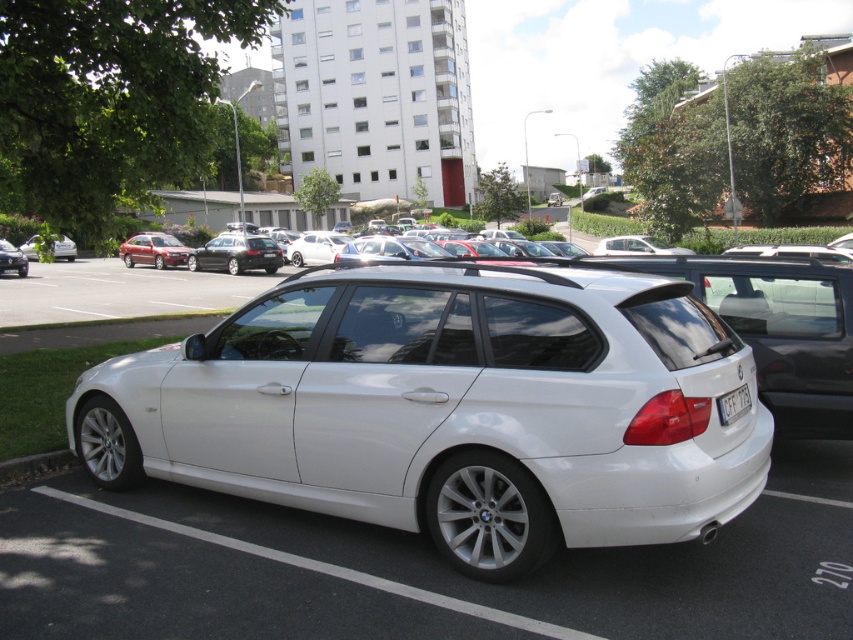
Who is more forward, [260,253] or [718,404]?

Positioned in front is point [718,404].

Between shiny black sedan at center and black plastic license plate at rear, which one is positioned higher?

Positioned higher is shiny black sedan at center.

Is point (206, 246) closer to camera compared to point (726, 417)?

No, it is behind (726, 417).

Where is `shiny black sedan at center`? The height and width of the screenshot is (640, 853). shiny black sedan at center is located at coordinates (236, 253).

Who is shorter, matte silver hatchback at left or matte black sedan at left?

matte black sedan at left

Based on the photo, is matte silver hatchback at left to the right of matte black sedan at left from the viewer's perspective?

Indeed, matte silver hatchback at left is positioned on the right side of matte black sedan at left.

Describe the element at coordinates (62, 248) in the screenshot. I see `matte silver hatchback at left` at that location.

This screenshot has width=853, height=640. What are the coordinates of `matte silver hatchback at left` in the screenshot? It's located at (62, 248).

Does metallic red sedan at center have a greater width compared to matte silver hatchback at left?

No, metallic red sedan at center is not wider than matte silver hatchback at left.

Who is higher up, metallic red sedan at center or matte silver hatchback at left?

Positioned higher is metallic red sedan at center.

Which is in front, point (169, 252) or point (33, 241)?

Point (169, 252) is more forward.

At what (x,y) coordinates should I click in order to perform the action: click on metallic red sedan at center. Please return your answer as a coordinate pair (x, y). This screenshot has width=853, height=640. Looking at the image, I should click on (154, 250).